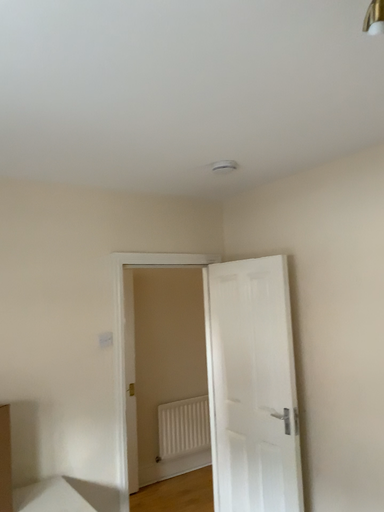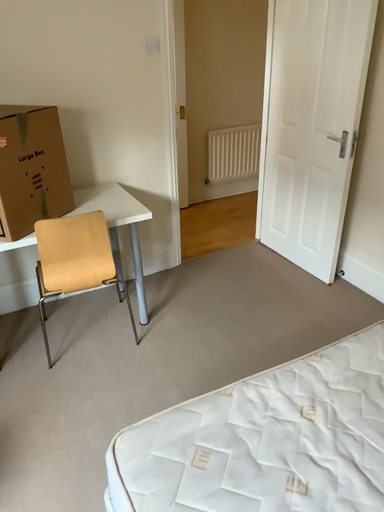
Question: How did the camera likely rotate when shooting the video?

Choices:
 (A) rotated upward
 (B) rotated downward

Answer: (B)